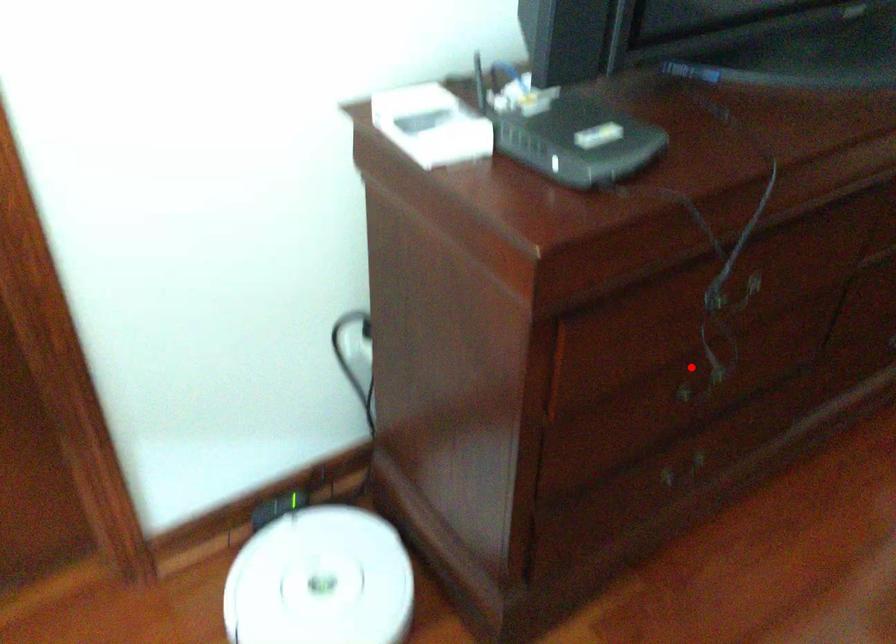
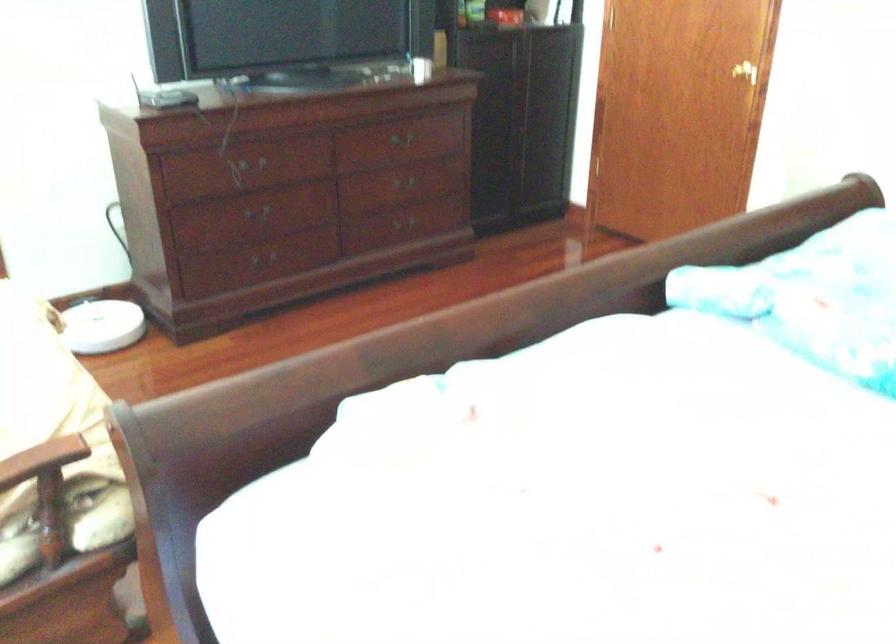
Question: A red point is marked in image1. In image2, is the corresponding 3D point closer to the camera or farther? Reply with the corresponding letter.

Choices:
 (A) The corresponding 3D point is closer.
 (B) The corresponding 3D point is farther.

Answer: (B)